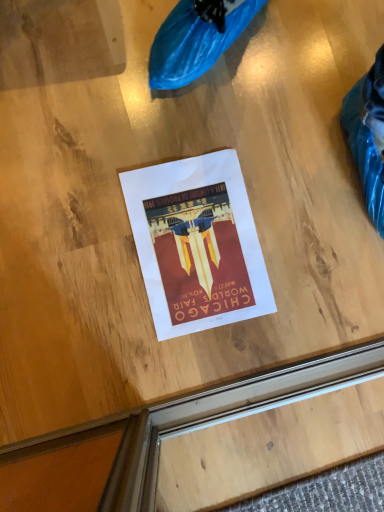
Identify the location of free space above matte paper poster at center (from a real-world perspective). (206, 245).